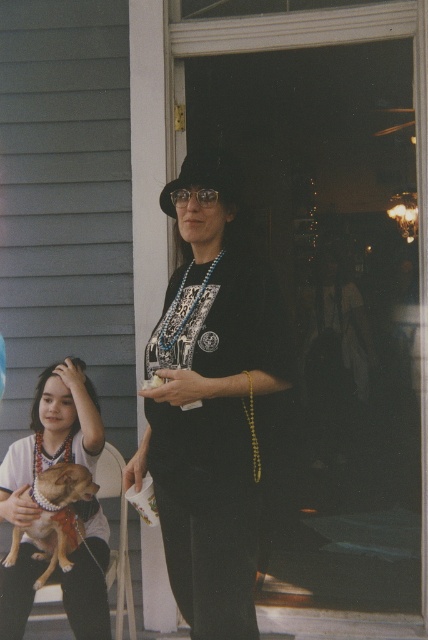
Does black matte dress at center appear on the right side of brown fur dog at lower left?

Correct, you'll find black matte dress at center to the right of brown fur dog at lower left.

Does black matte dress at center come behind brown fur dog at lower left?

No.

In order to click on black matte dress at center in this screenshot , I will do `click(211, 403)`.

Where is `black matte dress at center`? This screenshot has height=640, width=428. black matte dress at center is located at coordinates (211, 403).

Which of these two, matte black dress at center or brown fur dog at lower left, stands shorter?

With less height is brown fur dog at lower left.

Is matte black dress at center bigger than brown fur dog at lower left?

Correct, matte black dress at center is larger in size than brown fur dog at lower left.

Which is behind, point (50, 460) or point (44, 476)?

The point (50, 460) is more distant.

Where is `matte black dress at center`? The height and width of the screenshot is (640, 428). matte black dress at center is located at coordinates (51, 436).

Between black matte dress at center and matte black dress at center, which one has less height?

Standing shorter between the two is matte black dress at center.

Is black matte dress at center bigger than matte black dress at center?

Correct, black matte dress at center is larger in size than matte black dress at center.

Who is more forward, (207, 252) or (85, 436)?

Point (207, 252)

Where is `black matte dress at center`? black matte dress at center is located at coordinates click(x=211, y=403).